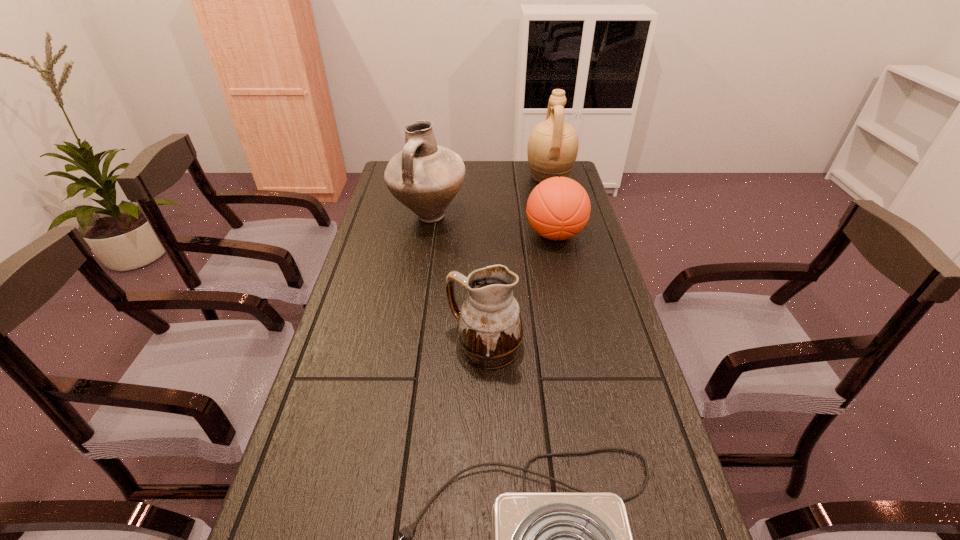
Where is `vacant space in between the fourth farthest object and the basketball`? vacant space in between the fourth farthest object and the basketball is located at coordinates 519,291.

You are a GUI agent. You are given a task and a screenshot of the screen. Output one action in this format:
    pyautogui.click(x=<x>, y=<y>)
    Task: Click on the free spot between the shortest pitcher and the fourth tallest object
    
    Given the screenshot: What is the action you would take?
    pyautogui.click(x=519, y=291)

You are a GUI agent. You are given a task and a screenshot of the screen. Output one action in this format:
    pyautogui.click(x=<x>, y=<y>)
    Task: Click on the free spot between the farthest pitcher and the second nearest pitcher
    
    Given the screenshot: What is the action you would take?
    pyautogui.click(x=489, y=196)

You are a GUI agent. You are given a task and a screenshot of the screen. Output one action in this format:
    pyautogui.click(x=<x>, y=<y>)
    Task: Click on the free point between the farthest object and the second farthest pitcher
    
    Given the screenshot: What is the action you would take?
    pyautogui.click(x=489, y=196)

Locate an element on the screen. empty space that is in between the rightmost pitcher and the second nearest pitcher is located at coordinates (489, 196).

Locate an element on the screen. The height and width of the screenshot is (540, 960). vacant space that's between the nearest pitcher and the basketball is located at coordinates (519, 291).

This screenshot has width=960, height=540. I want to click on object that ranks as the third closest to the second farthest pitcher, so click(x=489, y=331).

Locate which object ranks in proximity to the fourth tallest object. Please provide its 2D coordinates. Your answer should be formatted as a tuple, i.e. [(x, y)], where the tuple contains the x and y coordinates of a point satisfying the conditions above.

[(425, 177)]

Select which pitcher appears as the closest to the nearest object. Please provide its 2D coordinates. Your answer should be formatted as a tuple, i.e. [(x, y)], where the tuple contains the x and y coordinates of a point satisfying the conditions above.

[(489, 331)]

Identify the location of the third closest pitcher to the shortest object. Image resolution: width=960 pixels, height=540 pixels. (552, 149).